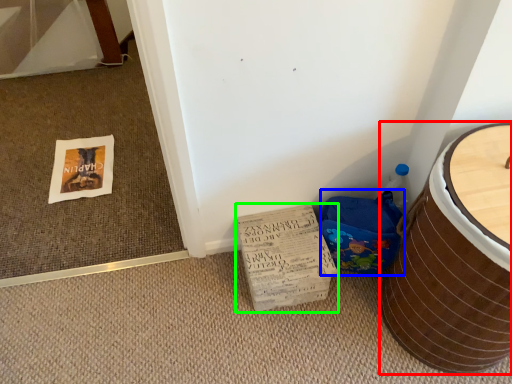
Question: Based on their relative distances, which object is farther from furniture (highlighted by a red box)? Choose from potty (highlighted by a blue box) and cardboard (highlighted by a green box).

Choices:
 (A) potty
 (B) cardboard

Answer: (B)